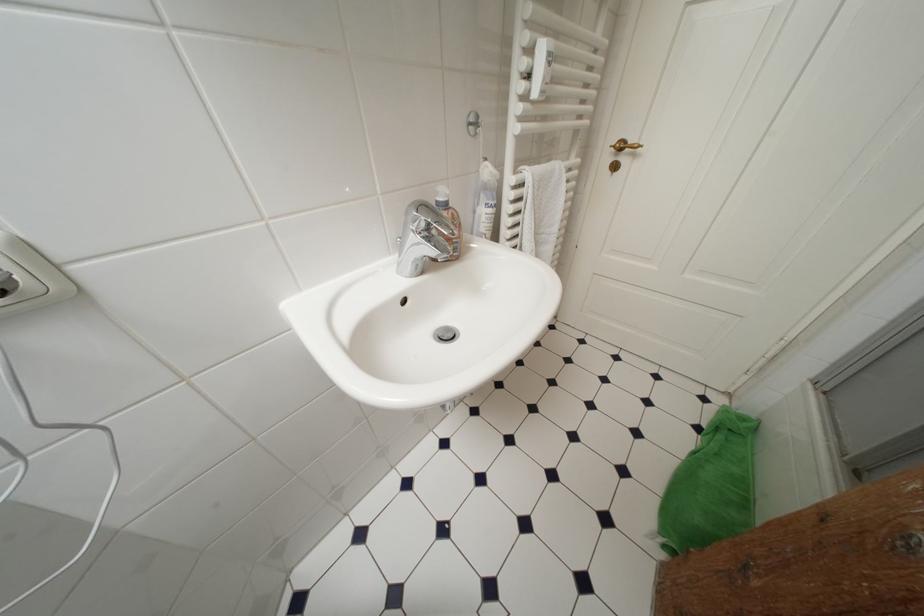
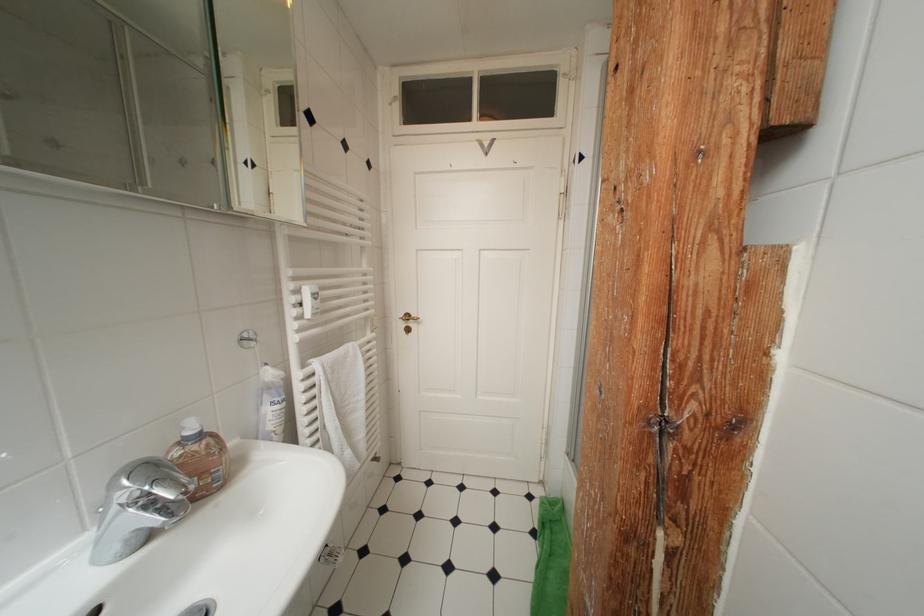
Locate, in the second image, the point that corresponds to pixel 533 175 in the first image.

(322, 368)